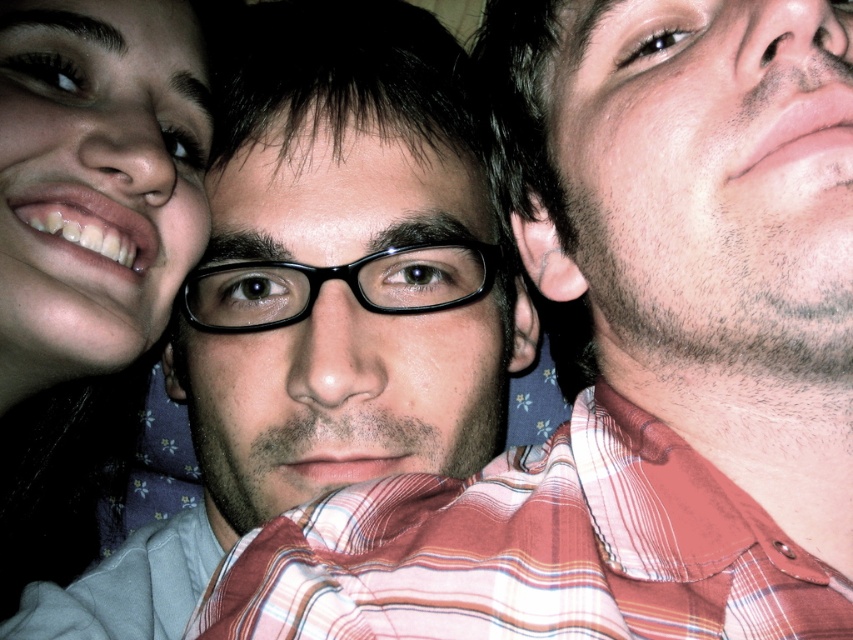
Can you confirm if black matte glasses at center is thinner than matte black glasses at left?

No.

Who is lower down, black matte glasses at center or matte black glasses at left?

black matte glasses at center

Identify the location of black matte glasses at center. (338, 324).

Find the location of a particular element. The image size is (853, 640). black matte glasses at center is located at coordinates (338, 324).

Is smooth skin face at right further to camera compared to black matte glasses at center?

No.

Does smooth skin face at right appear on the right side of black matte glasses at center?

Correct, you'll find smooth skin face at right to the right of black matte glasses at center.

Is point (827, 284) closer to viewer compared to point (224, 480)?

Yes, point (827, 284) is closer to viewer.

The height and width of the screenshot is (640, 853). I want to click on smooth skin face at right, so click(706, 182).

Is smooth skin face at right smaller than matte black glasses at left?

Correct, smooth skin face at right occupies less space than matte black glasses at left.

Who is more distant from viewer, (x=822, y=60) or (x=3, y=296)?

Point (x=3, y=296)

Where is `smooth skin face at right`? This screenshot has width=853, height=640. smooth skin face at right is located at coordinates (x=706, y=182).